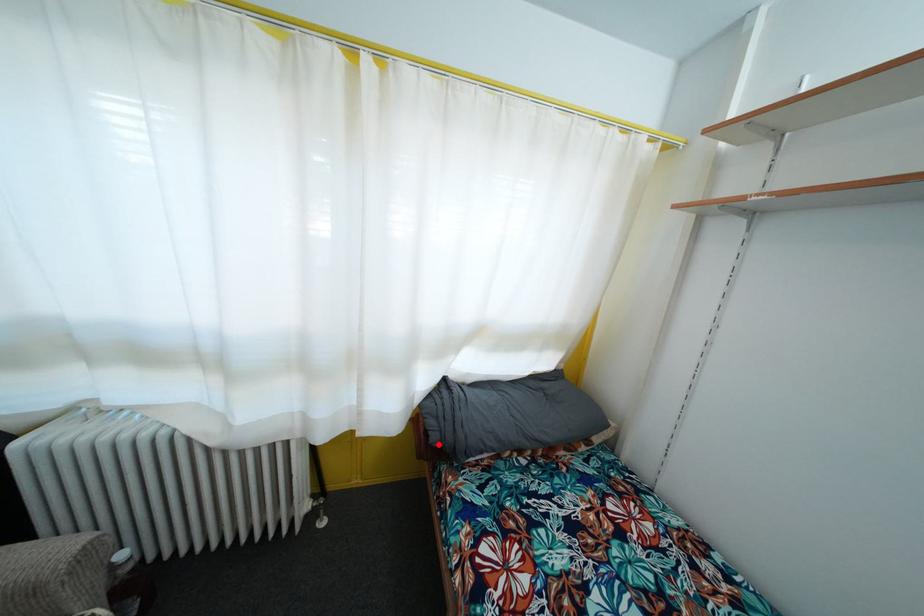
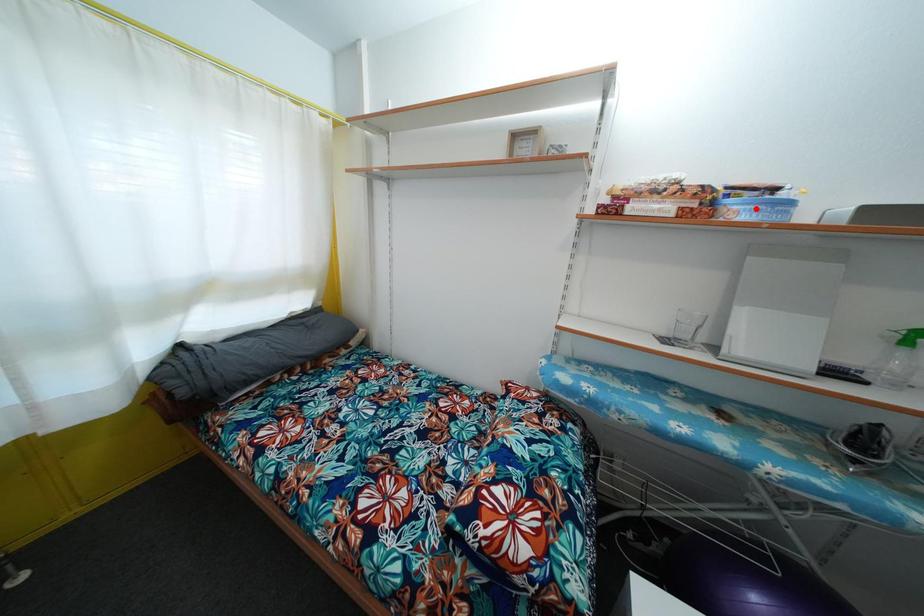
I am providing you with two images of the same scene from different viewpoints. A red point is marked on the first image and another point is marked on the second image. Are the points marked in image1 and image2 representing the same 3D position?

No